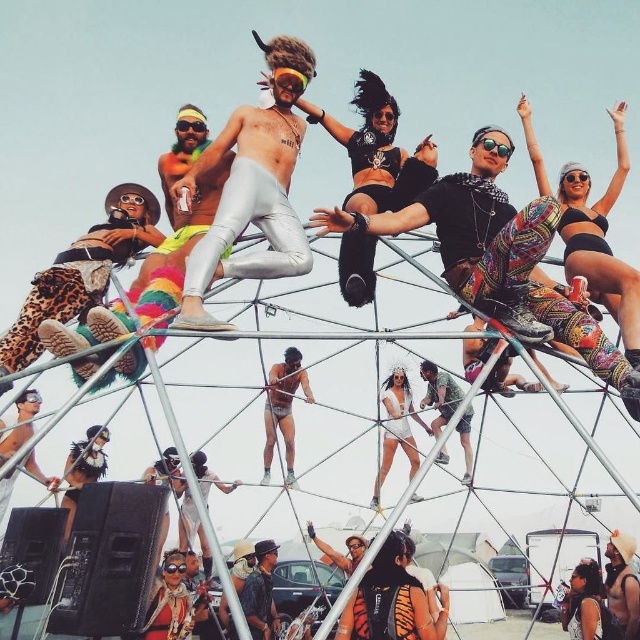
Question: Estimate the real-world distances between objects in this image. Which object is farther from the camouflage fabric shorts at center?

Choices:
 (A) white matte dress at center
 (B) metallic silver shorts at center

Answer: (B)

Question: Estimate the real-world distances between objects in this image. Which object is farther from the white matte dress at center?

Choices:
 (A) metallic silver shorts at center
 (B) camouflage fabric shorts at center

Answer: (A)

Question: Which object is the farthest from the camouflage fabric shorts at center?

Choices:
 (A) metallic silver shorts at center
 (B) white matte dress at center

Answer: (A)

Question: Can you confirm if metallic silver shorts at center is bigger than camouflage fabric shorts at center?

Choices:
 (A) no
 (B) yes

Answer: (B)

Question: Is white matte dress at center below camouflage fabric shorts at center?

Choices:
 (A) yes
 (B) no

Answer: (A)

Question: Does metallic silver shorts at center lie in front of camouflage fabric shorts at center?

Choices:
 (A) yes
 (B) no

Answer: (B)